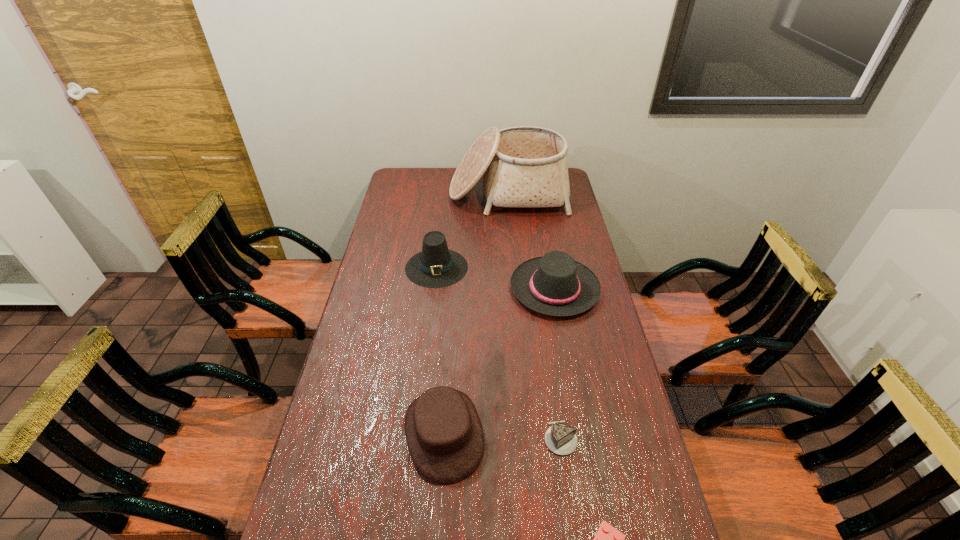
Find the location of `vacant region that satisfies the following two spatial constraints: 1. on the front-facing side of the tallest hat; 2. on the left side of the nearest hat`. vacant region that satisfies the following two spatial constraints: 1. on the front-facing side of the tallest hat; 2. on the left side of the nearest hat is located at coordinates (418, 433).

You are a GUI agent. You are given a task and a screenshot of the screen. Output one action in this format:
    pyautogui.click(x=<x>, y=<y>)
    Task: Click on the free space that satisfies the following two spatial constraints: 1. on the front-facing side of the rightmost hat; 2. on the left side of the second tallest object
    
    Given the screenshot: What is the action you would take?
    pyautogui.click(x=434, y=288)

The height and width of the screenshot is (540, 960). What are the coordinates of `vacant space that satisfies the following two spatial constraints: 1. on the front-facing side of the tallest hat; 2. on the right side of the rightmost hat` in the screenshot? It's located at (434, 288).